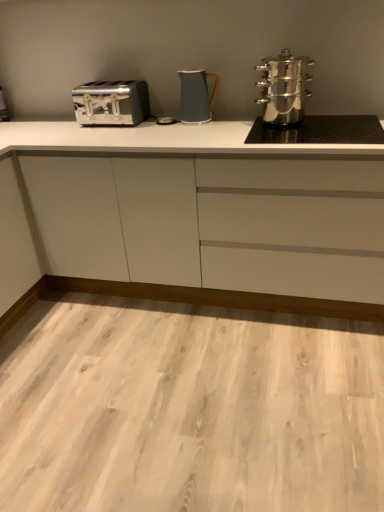
In order to click on vacant area that is situated to the right of satin silver toaster at left in this screenshot , I will do `click(22, 121)`.